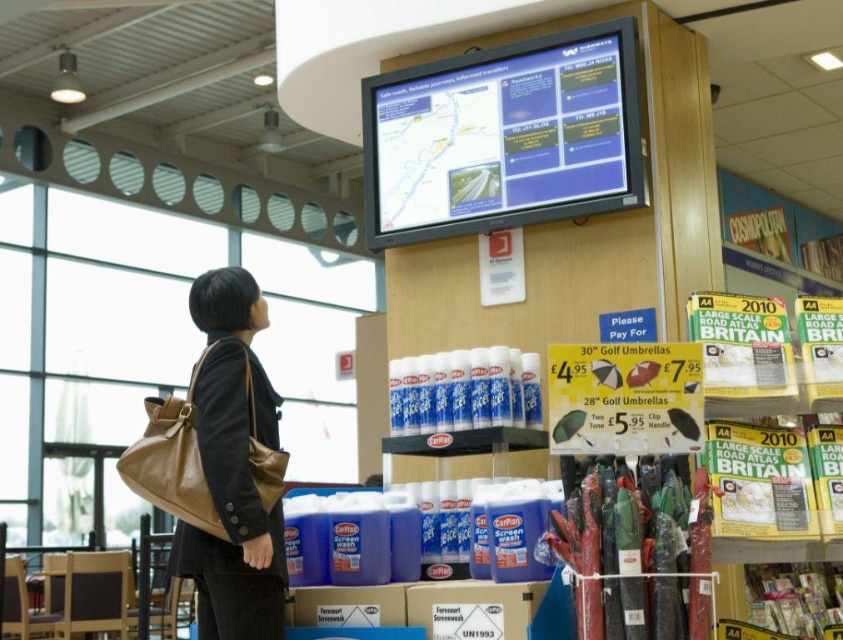
Can you confirm if brown leather bag at lower left is positioned to the right of brown leather bag at left?

Yes, brown leather bag at lower left is to the right of brown leather bag at left.

Measure the distance between point (212, 472) and camera.

They are 8.48 feet apart.

Is point (228, 424) positioned in front of point (229, 461)?

No, (228, 424) is further to viewer.

Where is `brown leather bag at lower left`? brown leather bag at lower left is located at coordinates (234, 468).